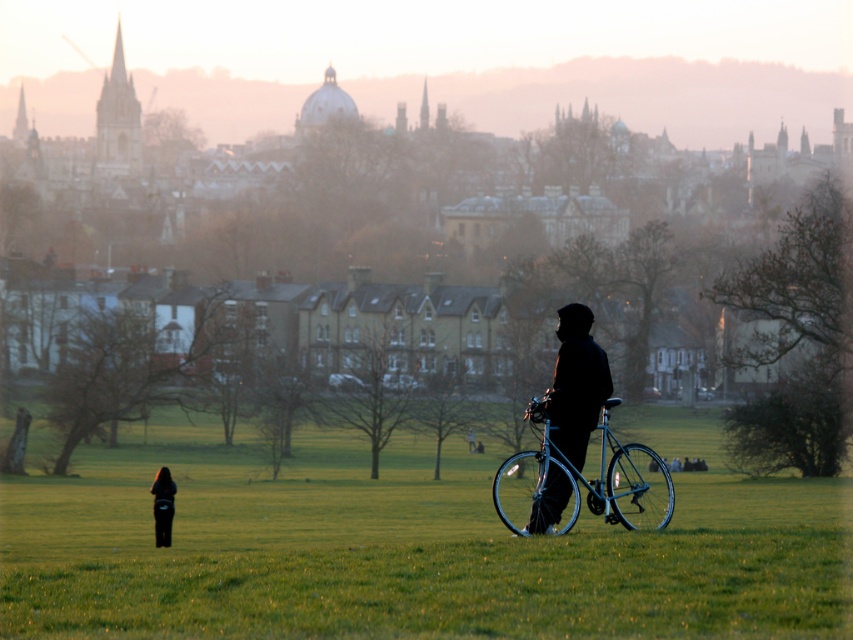
Consider the image. You are a photographer trying to capture a photo of the city skyline in the background. You have a metallic bicycle at center and a silhouette fabric jacket at center in your frame. Which object would block your view of the city skyline more if you don not move them?

The metallic bicycle at center is much taller than the silhouette fabric jacket at center, so it would block more of the city skyline view.

Looking at this image, you are standing in the park and want to borrow the shiny blue bicycle at center to ride to the nearby coffee shop. The coffee shop is 100 feet away from your current position. Can you reach the coffee shop without needing to return the bicycle first?

The shiny blue bicycle at center is 74.33 feet away from you. Since the coffee shop is 100 feet away, you can ride the bicycle to the coffee shop and won

Based on the photo, you are a delivery person who needs to park your shiny blue bicycle at center near the dark fabric jacket at lower left. Is there enough space between them to fit a 1.2 meter wide delivery box?

The shiny blue bicycle at center might be wider than dark fabric jacket at lower left, so it is uncertain if there is enough space to fit a 1.2 meter wide delivery box between them.